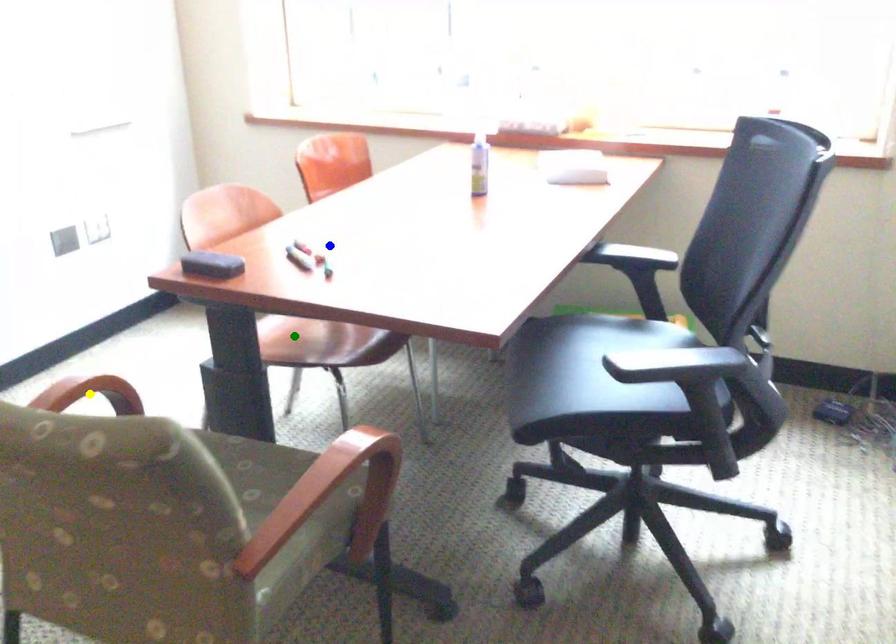
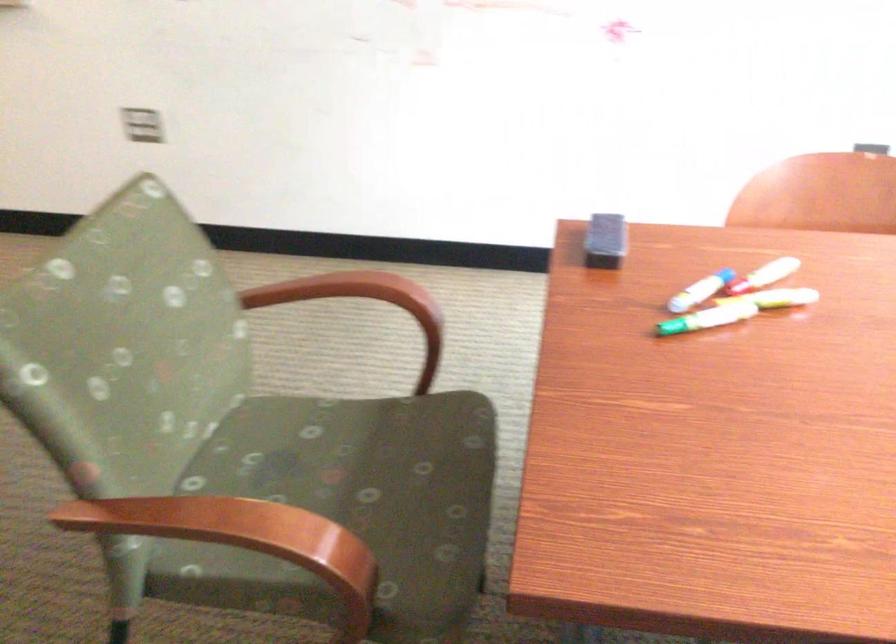
I am providing you with two images of the same scene from different viewpoints. Three points are marked in image1. Which point corresponds to a part or object that is occluded in image2?In image1, three points are marked. Which of them correspond to a part or object that is occluded in image2?Among the three points shown in image1, which one corresponds to a part or object that is no longer visible due to occlusion in image2?

yellow point, green point cannot be seen in image2.